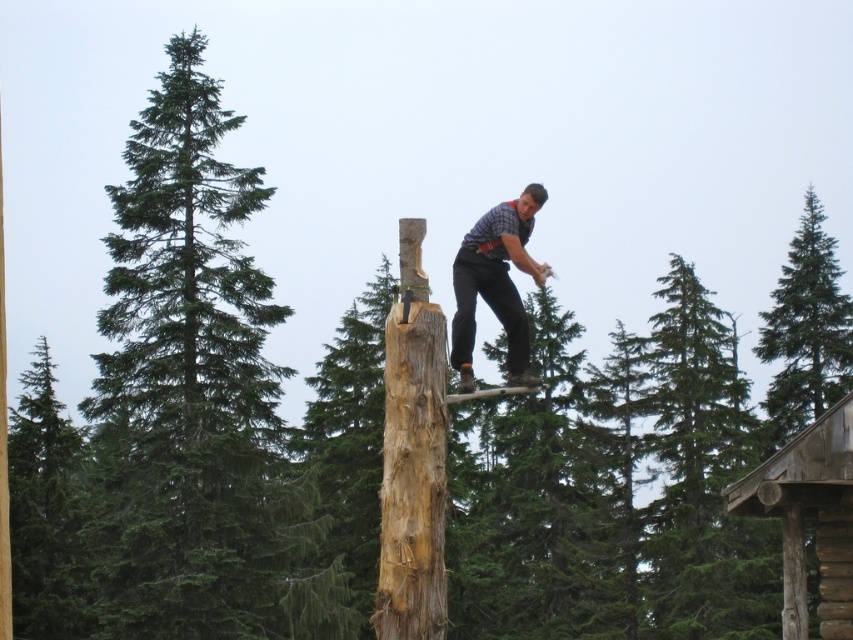
Is green textured tree at left wider than matte plaid shirt at center?

Correct, the width of green textured tree at left exceeds that of matte plaid shirt at center.

Is green textured tree at left smaller than matte plaid shirt at center?

Incorrect, green textured tree at left is not smaller in size than matte plaid shirt at center.

You are a GUI agent. You are given a task and a screenshot of the screen. Output one action in this format:
    pyautogui.click(x=<x>, y=<y>)
    Task: Click on the green textured tree at left
    The height and width of the screenshot is (640, 853).
    Given the screenshot: What is the action you would take?
    pyautogui.click(x=45, y=509)

Can you confirm if green textured tree at left is taller than green textured pine at upper right?

In fact, green textured tree at left may be shorter than green textured pine at upper right.

Does point (74, 484) come in front of point (787, 307)?

Yes.

Who is more distant from viewer, (16, 636) or (759, 316)?

Point (759, 316)

The image size is (853, 640). What are the coordinates of `green textured tree at left` in the screenshot? It's located at (45, 509).

Can you confirm if green coniferous tree at left is positioned below green textured pine at upper right?

No, green coniferous tree at left is not below green textured pine at upper right.

Does green coniferous tree at left have a greater width compared to green textured pine at upper right?

Correct, the width of green coniferous tree at left exceeds that of green textured pine at upper right.

Is point (196, 188) closer to viewer compared to point (798, 292)?

That is True.

Find the location of a particular element. green coniferous tree at left is located at coordinates (184, 380).